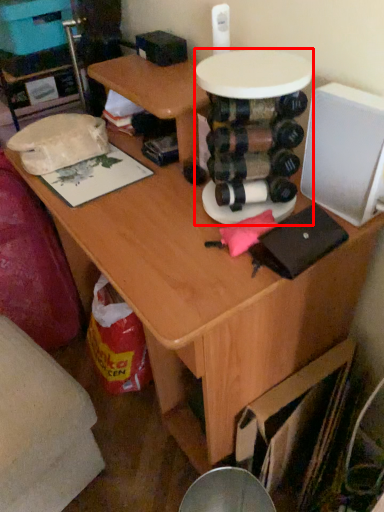
Question: From the image, what is the correct spatial relationship of round table (annotated by the red box) in relation to swivel chair?

Choices:
 (A) left
 (B) right

Answer: (B)